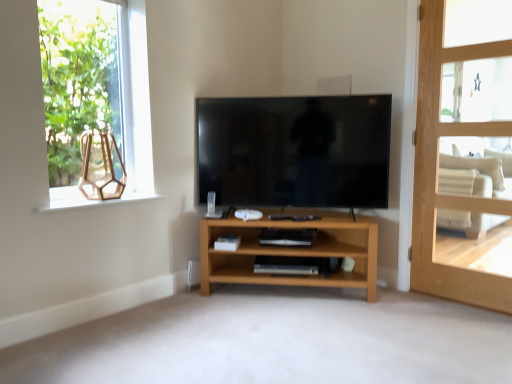
In order to face light brown wooden door at right, should I rotate leftwards or rightwards?

Turn right by 26.124 degrees to look at light brown wooden door at right.

Measure the distance between point (x=472, y=166) and camera.

4.23 meters.

What do you see at coordinates (95, 102) in the screenshot? The image size is (512, 384). I see `clear glass window at upper left` at bounding box center [95, 102].

I want to click on black glossy tv at center, so click(x=294, y=151).

Locate an element on the screen. light brown wooden door at right is located at coordinates (464, 151).

Is black glossy tv at center in front of or behind matte glass window sill at upper left in the image?

A: black glossy tv at center is positioned farther from the viewer than matte glass window sill at upper left.

In the scene shown: How distant is black glossy tv at center from matte glass window sill at upper left?

A distance of 34.49 inches exists between black glossy tv at center and matte glass window sill at upper left.

From a real-world perspective, is black glossy tv at center physically located above or below matte glass window sill at upper left?

black glossy tv at center is above matte glass window sill at upper left.

Image resolution: width=512 pixels, height=384 pixels. In order to click on window sill below the black glossy tv at center (from a real-world perspective) in this screenshot , I will do `click(89, 199)`.

In the scene shown: From the image's perspective, relative to clear glass window at upper left, is light wood shelf at center above or below?

From the image's perspective, light wood shelf at center appears below clear glass window at upper left.

Locate an element on the screen. window above the light wood shelf at center (from a real-world perspective) is located at coordinates (95, 102).

In the scene shown: Would you say light wood shelf at center is inside or outside clear glass window at upper left?

light wood shelf at center lies outside clear glass window at upper left.

Does black glossy tv at center have a lesser width compared to clear glass window at upper left?

In fact, black glossy tv at center might be wider than clear glass window at upper left.

Considering the positions of objects black glossy tv at center and clear glass window at upper left in the image provided, who is more to the left, black glossy tv at center or clear glass window at upper left?

clear glass window at upper left.

From the image's perspective, between black glossy tv at center and clear glass window at upper left, which one is located above?

clear glass window at upper left, from the image's perspective.

In terms of size, does black glossy tv at center appear bigger or smaller than clear glass window at upper left?

black glossy tv at center is bigger than clear glass window at upper left.

Considering the positions of objects clear glass window at upper left and light brown wooden door at right in the image provided, who is in front, clear glass window at upper left or light brown wooden door at right?

light brown wooden door at right.

Who is taller, clear glass window at upper left or light brown wooden door at right?

light brown wooden door at right.

Is light brown wooden door at right at the back of clear glass window at upper left?

No.

From a real-world perspective, which object stands above the other?

clear glass window at upper left, from a real-world perspective.

Is light brown wooden door at right aimed at black glossy tv at center?

No, light brown wooden door at right is not oriented towards black glossy tv at center.

Which point is more forward, (510,149) or (296,155)?

The point (296,155) is closer.

Would you say light brown wooden door at right is outside black glossy tv at center?

Indeed, light brown wooden door at right is completely outside black glossy tv at center.

Considering the positions of objects light brown wooden door at right and black glossy tv at center in the image provided, who is behind, light brown wooden door at right or black glossy tv at center?

black glossy tv at center is behind.

Which is farther from the camera, (486,150) or (39,11)?

The point (486,150) is behind.

From a real-world perspective, which object rests below the other?

beige fabric armchair at right.

Is beige fabric armchair at right positioned behind clear glass window at upper left?

Yes, beige fabric armchair at right is behind clear glass window at upper left.

Could you tell me if light brown wooden door at right is turned towards clear glass window at upper left?

No.

Is light brown wooden door at right further to camera compared to clear glass window at upper left?

No, light brown wooden door at right is closer to the viewer.

Which object is positioned more to the left, light brown wooden door at right or clear glass window at upper left?

Positioned to the left is clear glass window at upper left.

Which is correct: light brown wooden door at right is inside clear glass window at upper left, or outside of it?

light brown wooden door at right cannot be found inside clear glass window at upper left.

Where is `television on the right of matte glass window sill at upper left`? The width and height of the screenshot is (512, 384). television on the right of matte glass window sill at upper left is located at coordinates (294, 151).

Where is `window lying in front of the light wood shelf at center`? Image resolution: width=512 pixels, height=384 pixels. window lying in front of the light wood shelf at center is located at coordinates (95, 102).

When comparing their distances from beige fabric armchair at right, does light brown wooden door at right or black glossy tv at center seem further?

Based on the image, black glossy tv at center appears to be further to beige fabric armchair at right.

Estimate the real-world distances between objects in this image. Which object is closer to clear glass window at upper left, beige fabric armchair at right or light brown wooden door at right?

Based on the image, light brown wooden door at right appears to be nearer to clear glass window at upper left.

From the picture: Which object lies nearer to the anchor point beige fabric armchair at right, matte glass window sill at upper left or light wood shelf at center?

Among the two, light wood shelf at center is located nearer to beige fabric armchair at right.

Which object lies nearer to the anchor point beige fabric armchair at right, light wood shelf at center or black glossy tv at center?

Based on the image, light wood shelf at center appears to be nearer to beige fabric armchair at right.

Which object lies further to the anchor point light wood shelf at center, beige fabric armchair at right or light brown wooden door at right?

beige fabric armchair at right lies further to light wood shelf at center than the other object.

Looking at the image, which one is located closer to light wood shelf at center, black glossy tv at center or matte glass window sill at upper left?

black glossy tv at center is closer to light wood shelf at center.

From the image, which object appears to be farther from matte glass window sill at upper left, beige fabric armchair at right or black glossy tv at center?

Based on the image, beige fabric armchair at right appears to be further to matte glass window sill at upper left.

Estimate the real-world distances between objects in this image. Which object is closer to clear glass window at upper left, light brown wooden door at right or matte glass window sill at upper left?

matte glass window sill at upper left is positioned closer to the anchor clear glass window at upper left.

Where is `television located between light wood shelf at center and light brown wooden door at right in the left-right direction`? This screenshot has height=384, width=512. television located between light wood shelf at center and light brown wooden door at right in the left-right direction is located at coordinates tap(294, 151).

You are a GUI agent. You are given a task and a screenshot of the screen. Output one action in this format:
    pyautogui.click(x=<x>, y=<y>)
    Task: Click on the shelf between matte glass window sill at upper left and light brown wooden door at right from left to right
    
    Given the screenshot: What is the action you would take?
    pyautogui.click(x=291, y=252)

Identify the location of television between clear glass window at upper left and light brown wooden door at right. This screenshot has width=512, height=384. (294, 151).

Where is `door situated between black glossy tv at center and beige fabric armchair at right from left to right`? This screenshot has width=512, height=384. door situated between black glossy tv at center and beige fabric armchair at right from left to right is located at coordinates (464, 151).